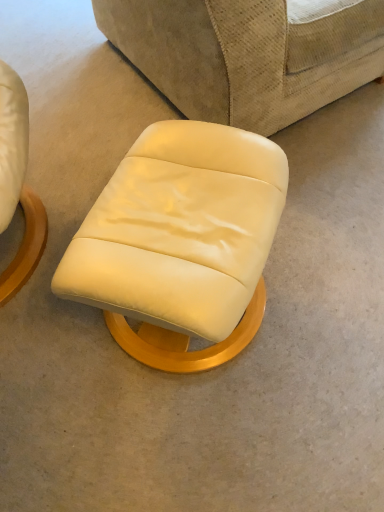
The image size is (384, 512). Find the location of `free spot in front of matte cream leather ottoman at center`. free spot in front of matte cream leather ottoman at center is located at coordinates (193, 441).